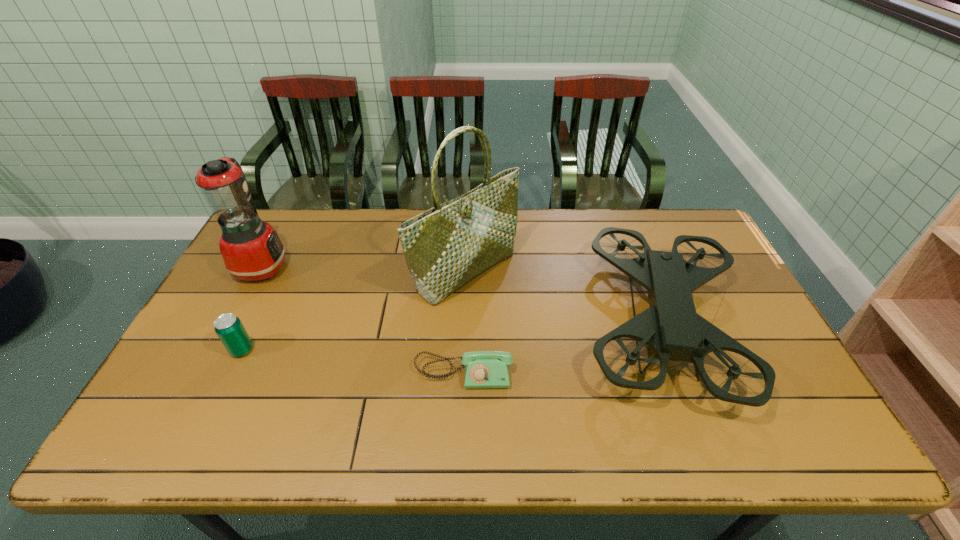
Where is `the tallest object`? The width and height of the screenshot is (960, 540). the tallest object is located at coordinates (447, 246).

This screenshot has height=540, width=960. In order to click on the fourth shortest object in this screenshot , I will do `click(251, 249)`.

Locate an element on the screen. the third shortest object is located at coordinates (670, 326).

The height and width of the screenshot is (540, 960). Identify the location of the rightmost object. (670, 326).

At what (x,y) coordinates should I click in order to perform the action: click on the second shortest object. Please return your answer as a coordinate pair (x, y). The height and width of the screenshot is (540, 960). Looking at the image, I should click on (229, 328).

Locate an element on the screen. The image size is (960, 540). the shortest object is located at coordinates (483, 369).

At what (x,y) coordinates should I click in order to perform the action: click on vacant space located 0.260m on the left of the shopping bag. Please return your answer as a coordinate pair (x, y). Looking at the image, I should click on click(333, 271).

I want to click on free space located on the controls of the second tallest object, so pos(366,266).

Find the location of a particular element. Image resolution: width=960 pixels, height=540 pixels. free region located on the left of the third tallest object is located at coordinates (440, 323).

Identify the location of vacant space situated 0.370m on the back of the second shortest object. The width and height of the screenshot is (960, 540). coord(288,252).